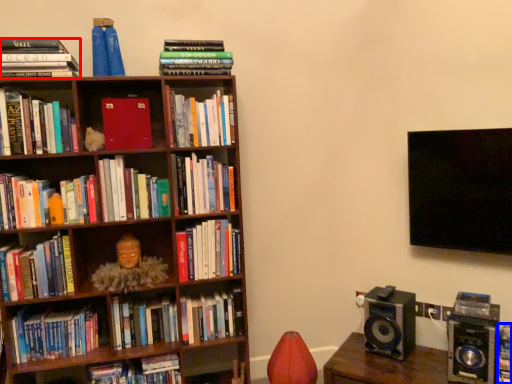
Question: Among these objects, which one is nearest to the camera, book (highlighted by a red box) or book (highlighted by a blue box)?

Choices:
 (A) book
 (B) book

Answer: (B)